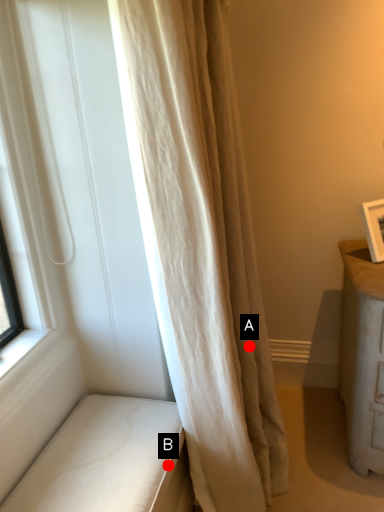
Question: Two points are circled on the image, labeled by A and B beside each circle. Which point appears farthest from the camera in this image?

Choices:
 (A) A is further
 (B) B is further

Answer: (A)